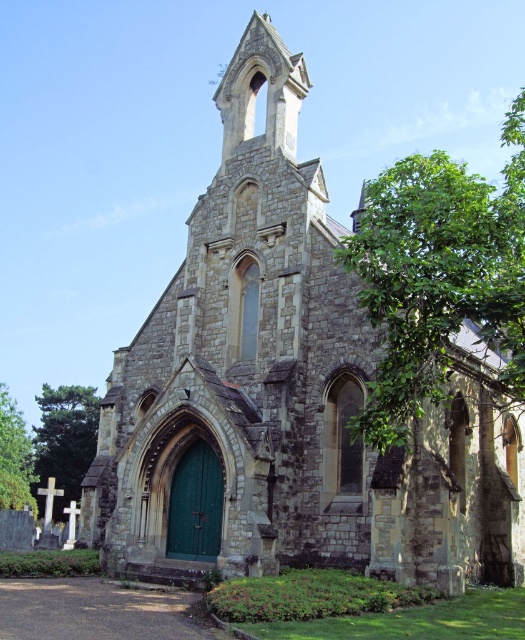
Question: Which of the following is the farthest from the observer?

Choices:
 (A) green leafy tree at left
 (B) green leafy tree at right
 (C) green leafy tree at lower left

Answer: (A)

Question: Can you confirm if green leafy tree at left is bigger than green leafy tree at lower left?

Choices:
 (A) yes
 (B) no

Answer: (B)

Question: Among these points, which one is nearest to the camera?

Choices:
 (A) (403, 426)
 (B) (26, 481)

Answer: (A)

Question: Can you confirm if green leafy tree at left is positioned below green leafy tree at lower left?

Choices:
 (A) no
 (B) yes

Answer: (A)

Question: Where is green leafy tree at right located in relation to green leafy tree at lower left in the image?

Choices:
 (A) right
 (B) left

Answer: (A)

Question: Which object is farther from the camera taking this photo?

Choices:
 (A) green leafy tree at lower left
 (B) green leafy tree at right
 (C) green leafy tree at left

Answer: (C)